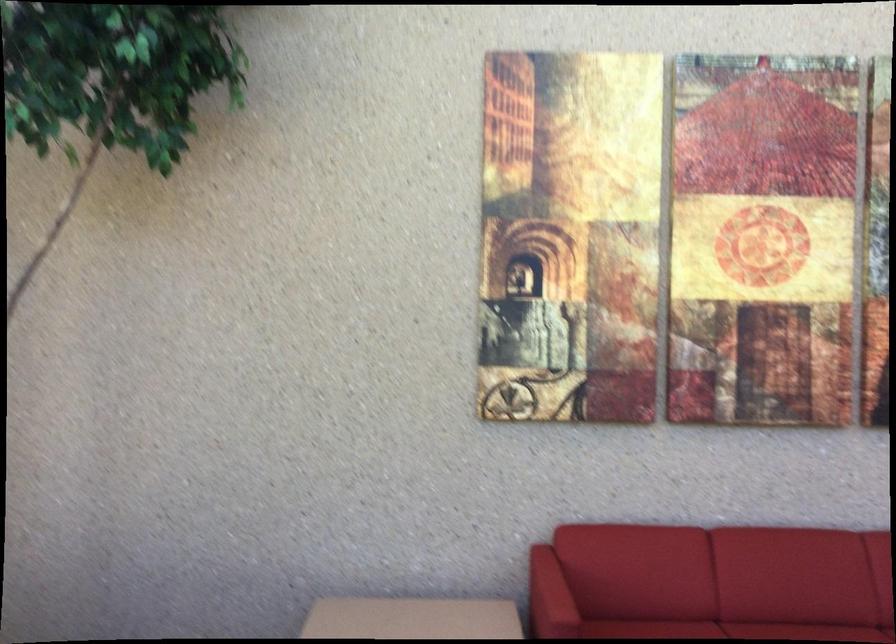
The height and width of the screenshot is (644, 896). What are the coordinates of `sofa sitting surface` in the screenshot? It's located at (727, 630).